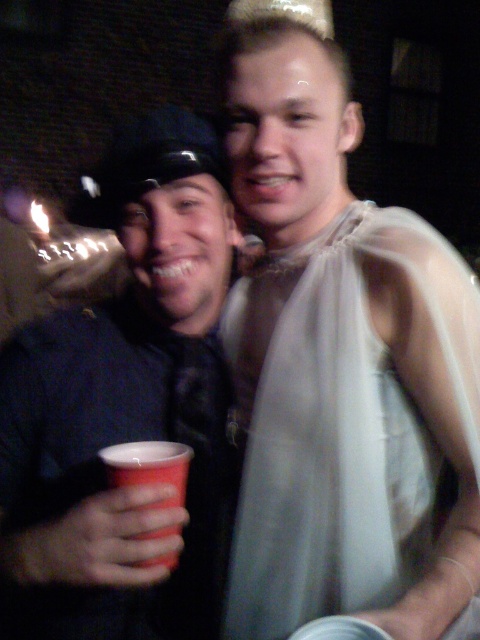
You are at a party and want to take a photo with the two people in the image. You are currently standing 36.09 inches away from the point marked at coordinates point [135,369]. Is this distance sufficient to include both individuals in the frame?

The distance between you and the point [135,369] is exactly 36.09 inches, which is the required distance to capture both individuals in the frame since they are positioned closely together at the gathering.

You are at a party and need to place a small note between the matte black cup at left and the sheer white dress at right. Can you fit it there?

The matte black cup at left is thinner than the sheer white dress at right, so there is enough space between them to fit a small note.

You are a photographer trying to capture a clear photo of both the matte black cup at left and the sheer white dress at right. Since the background is dimly lit, you want to ensure both objects are in focus. Which object should you focus on first to ensure the other is also in focus?

A: The matte black cup at left is located above the sheer white dress at right. Since the cup is higher up, focusing on it first would likely keep the dress in focus as well due to the overlapping planes in the scene.